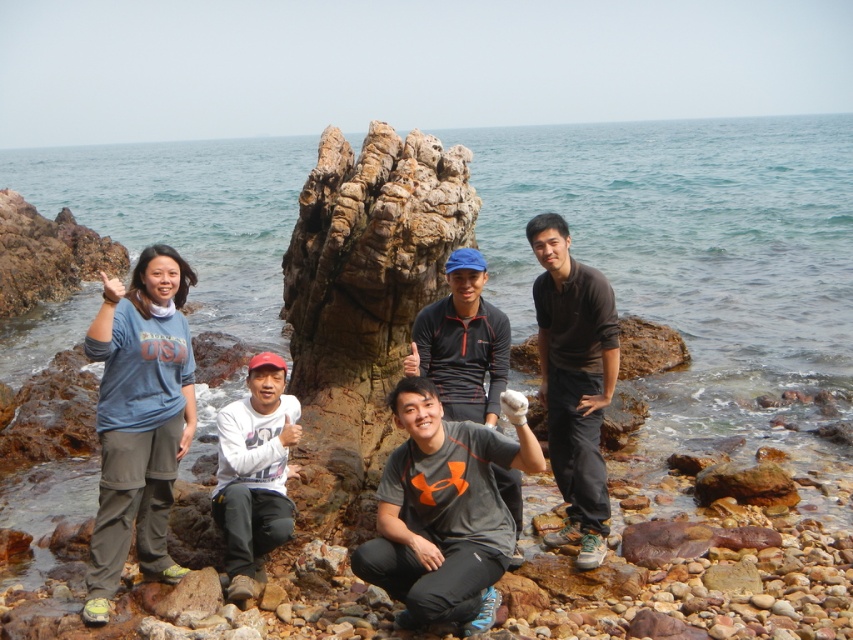
Is white matte shirt at center wider than dark gray fleece jacket at center?

No, white matte shirt at center is not wider than dark gray fleece jacket at center.

Which is more to the left, white matte shirt at center or dark gray fleece jacket at center?

white matte shirt at center is more to the left.

Where is `white matte shirt at center`? The width and height of the screenshot is (853, 640). white matte shirt at center is located at coordinates (254, 472).

This screenshot has width=853, height=640. I want to click on white matte shirt at center, so click(254, 472).

Who is lower down, rusty stone rock at center or blue cotton shirt at center?

blue cotton shirt at center

Is rusty stone rock at center positioned at the back of blue cotton shirt at center?

Yes, it is.

Locate an element on the screen. rusty stone rock at center is located at coordinates (363, 301).

Between blue cotton shirt at center and black matte shirt at center, which one is positioned lower?

blue cotton shirt at center

Does blue cotton shirt at center appear on the left side of black matte shirt at center?

Indeed, blue cotton shirt at center is positioned on the left side of black matte shirt at center.

Does point (119, 406) come closer to viewer compared to point (599, 401)?

Yes, it is.

Identify the location of blue cotton shirt at center. This screenshot has width=853, height=640. (138, 419).